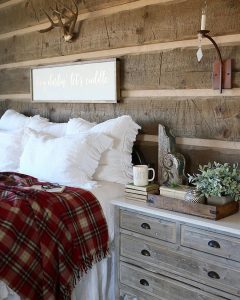
Image resolution: width=240 pixels, height=300 pixels. Find the location of `tray wooden`. tray wooden is located at coordinates (202, 213).